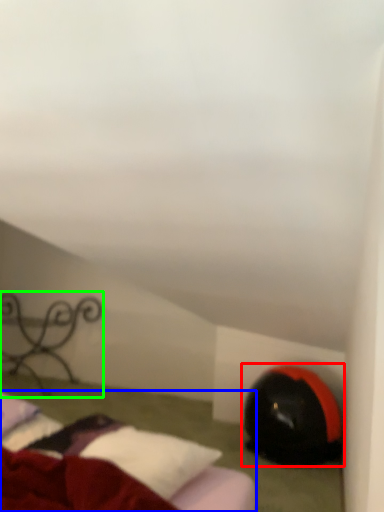
Question: Estimate the real-world distances between objects in this image. Which object is closer to bean bag chair (highlighted by a red box), bed (highlighted by a blue box) or furniture (highlighted by a green box)?

Choices:
 (A) bed
 (B) furniture

Answer: (A)